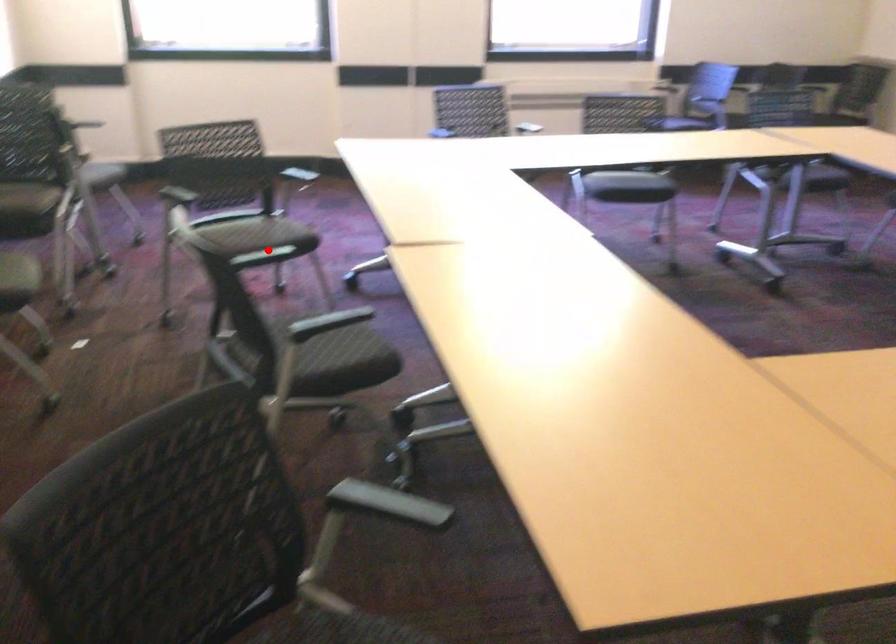
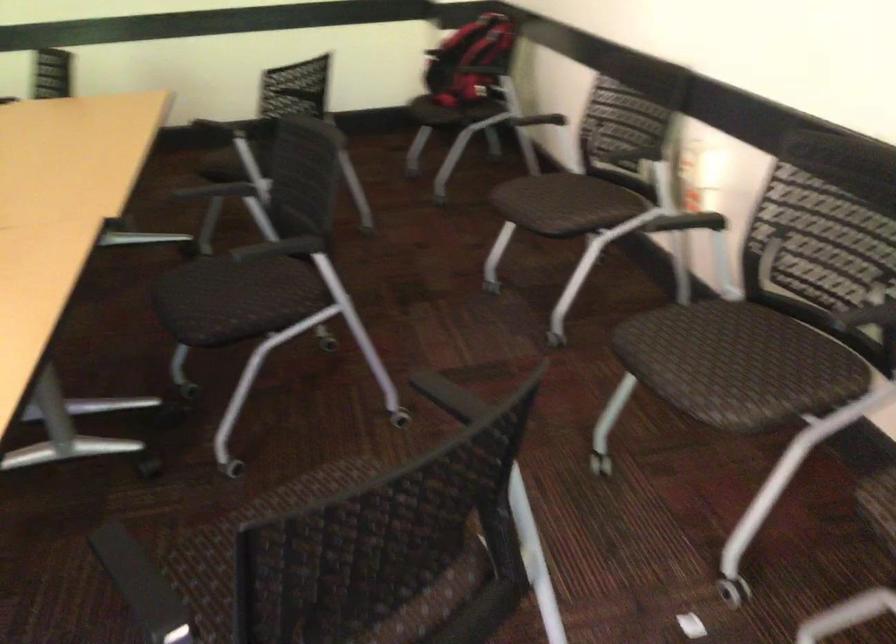
In the second image, find the point that corresponds to the highlighted location in the first image.

(313, 487)